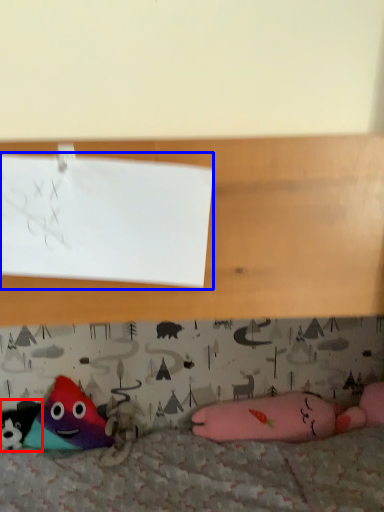
Question: Which object is closer to the camera taking this photo, toy (highlighted by a red box) or paper (highlighted by a blue box)?

Choices:
 (A) toy
 (B) paper

Answer: (B)